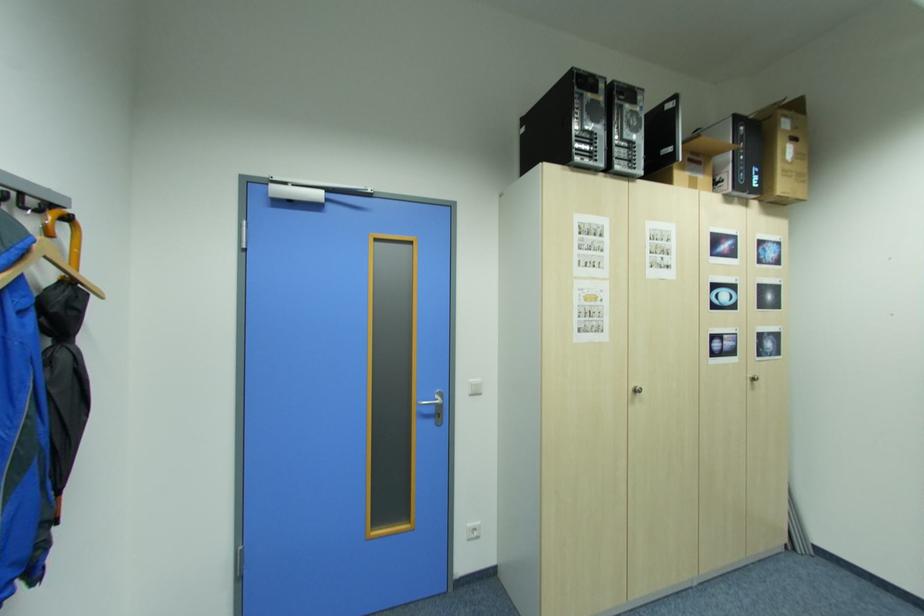
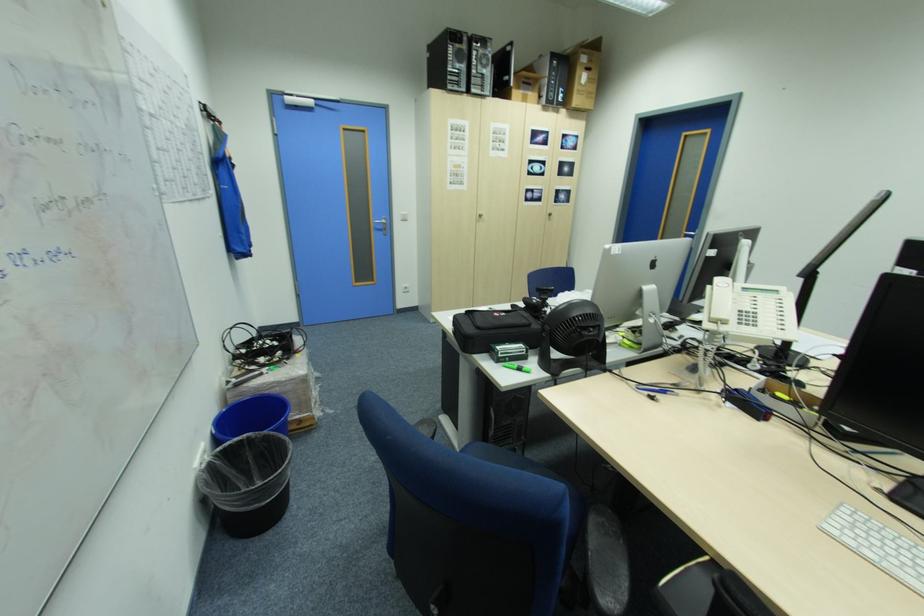
Question: In a continuous first-person perspective shot, in which direction is the camera moving?

Choices:
 (A) Left
 (B) Right
 (C) Forward
 (D) Backward

Answer: (D)